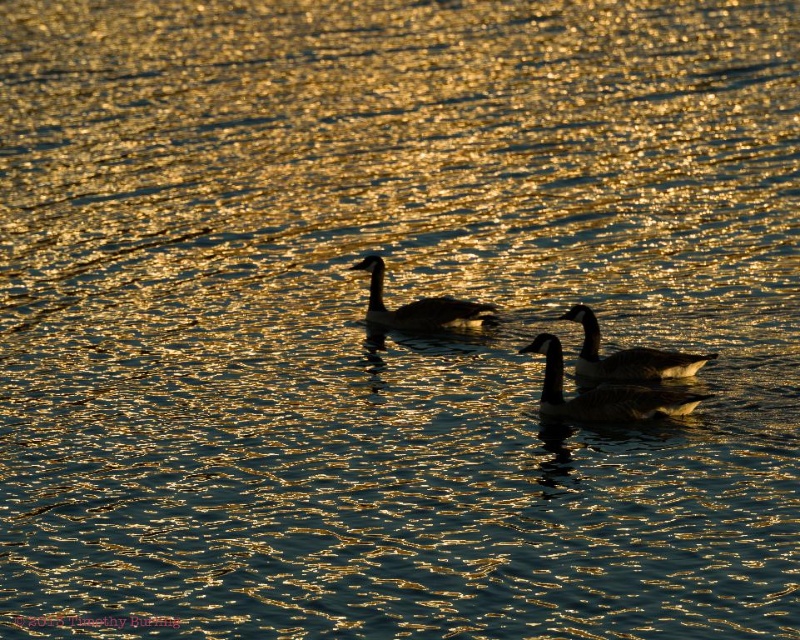
You are standing at the edge of the water and see two points in the scene, point 1 at coordinates point (698, 353) and point 2 at coordinates point (432, 310). Which point is closer to you?

Point (698, 353) is further to the viewer than point (432, 310), so point (432, 310) is closer to you.

You are a birdwatcher observing the geese in the golden hour scene. You notice two groups of feathers on the water surface. Which group, the dark gray feathers at center or the dark brown feathers at center, is positioned lower in the water?

The dark gray feathers at center is located below dark brown feathers at center, so the dark gray feathers at center is positioned lower in the water.

You are a birdwatcher observing the geese in the golden hour scene. You notice two geese with distinct feather colors at the center of the image. Which goose, the dark gray feathers at center or the dark brown feathers at center, is positioned to the right?

The dark brown feathers at center is positioned to the right of the dark gray feathers at center.